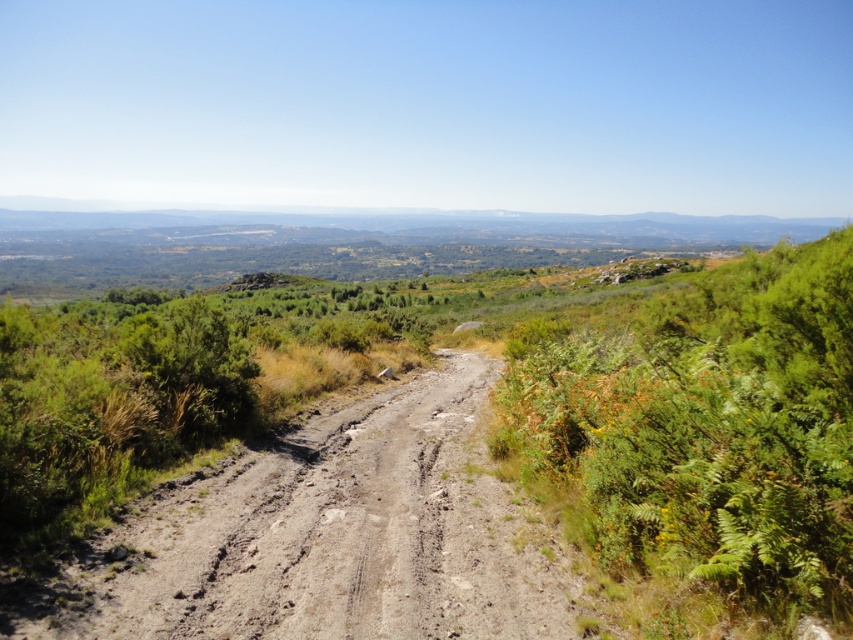
You are a hiker trying to follow the brown dirt track at center. There are green leafy shrubs at right nearby. Which direction should you walk to stay on the track and avoid the shrubs?

The green leafy shrubs at right are on the right side of the brown dirt track at center, so you should walk to the left side of the track to avoid them.

You are standing at the starting point of the dirt path in the rural landscape. You see two points marked on the path. One is at coordinates point (769, 330) and the other is at point (189, 634). Which point is closer to your current position?

Point (189, 634) is closer to your current position because it is nearer to the camera compared to point (769, 330), which is further away.

You are a hiker trying to determine the safest path through this rural landscape. You notice the green leafy shrubs at right and the brown dirt track at center. Which of these two features is wider?

The green leafy shrubs at right are wider than the brown dirt track at center according to the description provided.